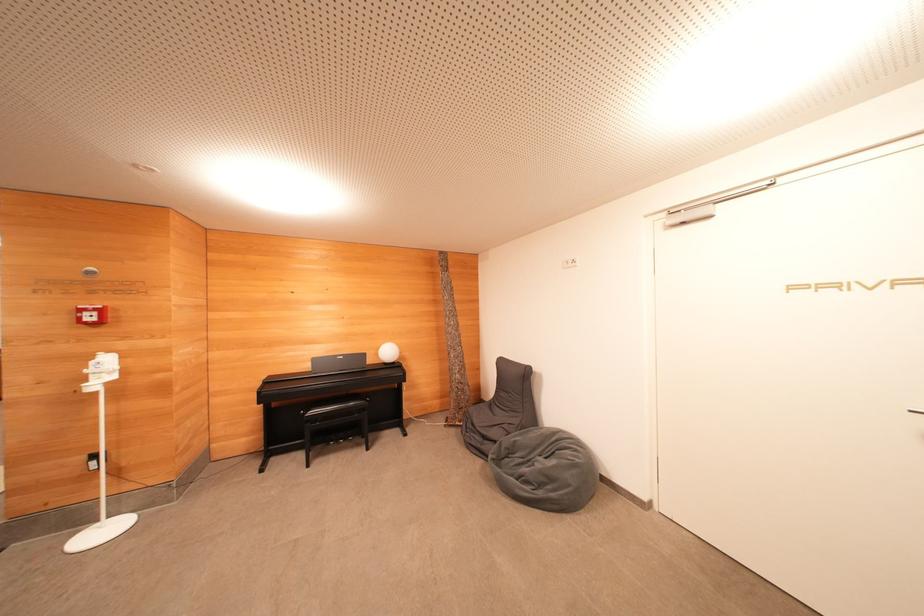
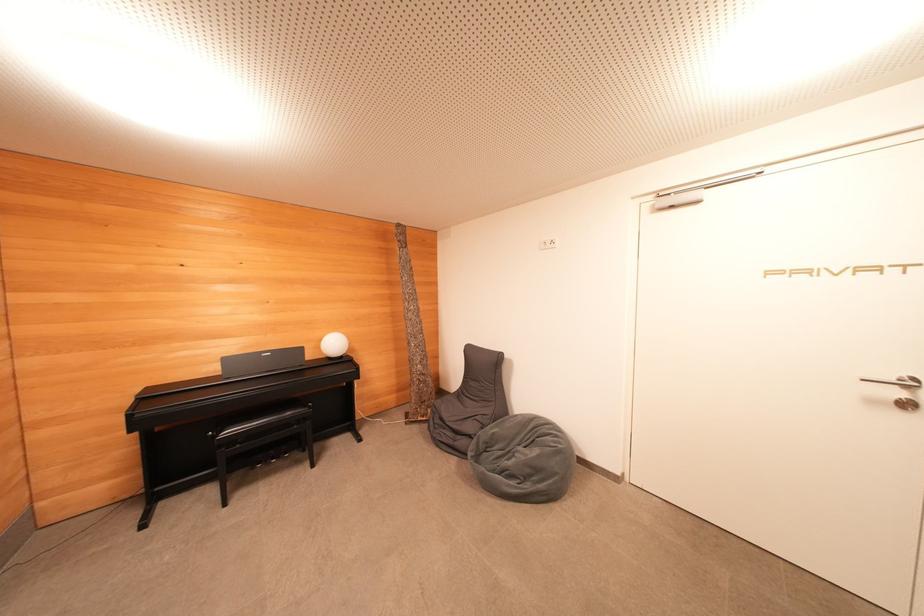
The point at [342,411] is marked in the first image. Where is the corresponding point in the second image?

(269, 423)